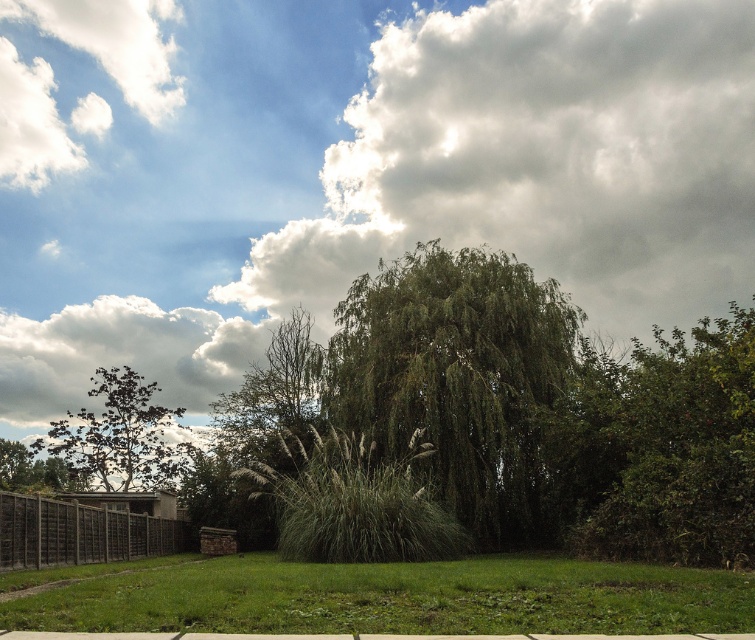
Question: Does green grassy at lower center appear under wooden fence at lower left?

Choices:
 (A) no
 (B) yes

Answer: (A)

Question: Considering the real-world distances, which object is farthest from the green leafy bush at right?

Choices:
 (A) wooden fence at lower left
 (B) green leafy tree at center
 (C) green grassy at lower center
 (D) cloudy sky at upper center

Answer: (D)

Question: In this image, where is green leafy tree at center located relative to green grassy at lower center?

Choices:
 (A) left
 (B) right

Answer: (B)

Question: Does green grassy at lower center appear on the right side of green leafy tree at left?

Choices:
 (A) yes
 (B) no

Answer: (A)

Question: Which point is closer to the camera taking this photo?

Choices:
 (A) tap(723, 481)
 (B) tap(180, 524)
 (C) tap(408, 595)
 (D) tap(541, 304)

Answer: (C)

Question: Which point is closer to the camera?

Choices:
 (A) (94, 589)
 (B) (116, 417)
 (C) (700, 492)
 (D) (522, 496)

Answer: (A)